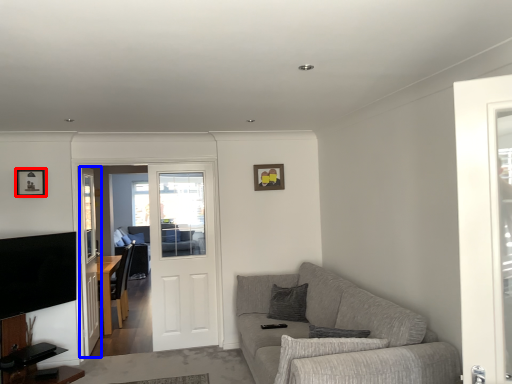
Question: Which object appears farthest to the camera in this image, picture frame (highlighted by a red box) or screen door (highlighted by a blue box)?

Choices:
 (A) picture frame
 (B) screen door

Answer: (B)